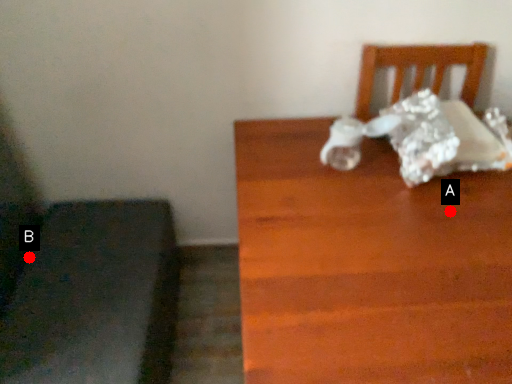
Question: Two points are circled on the image, labeled by A and B beside each circle. Which of the following is the farthest from the observer?

Choices:
 (A) A is further
 (B) B is further

Answer: (B)